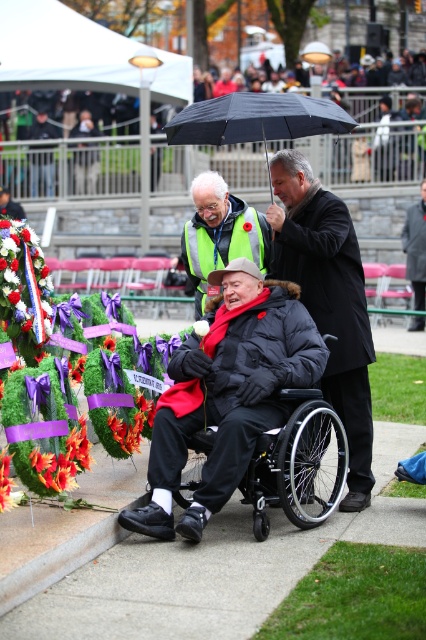
You are a photographer at the ceremony. You want to take a photo of the dark gray coat at center and the white fabric flower at center such that both are in focus. The camera you are using has a depth of field that can cover objects within a 10 meter range. Is this possible?

The dark gray coat at center is 12.42 meters from the white fabric flower at center, which exceeds the camera depth of field range of 10 meters. Therefore, it is not possible to have both in focus.